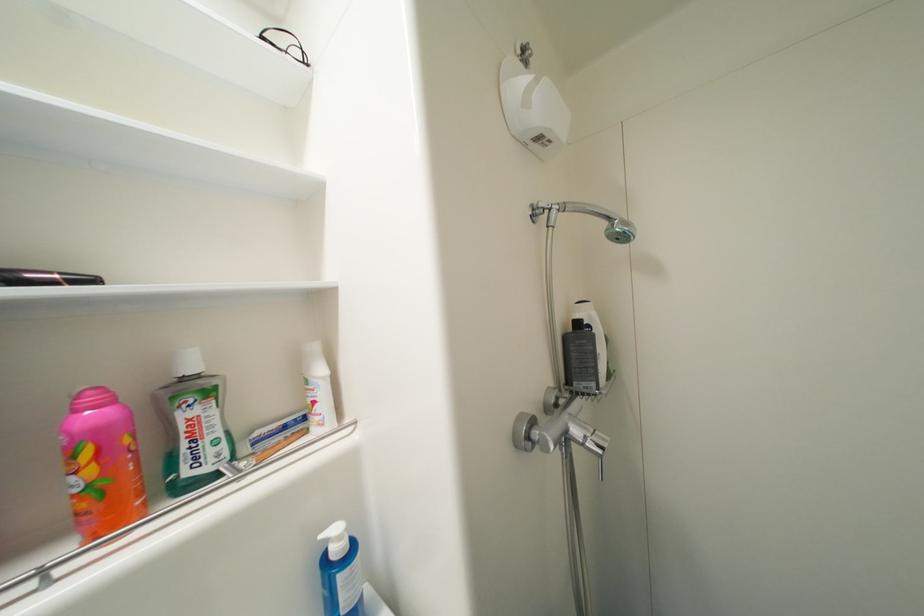
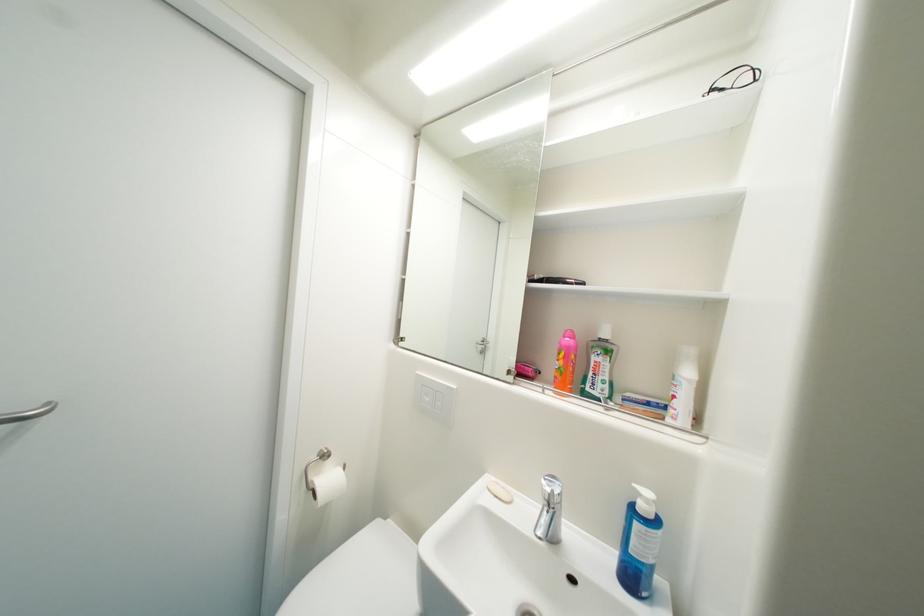
Where in the second image is the point corresponding to [263,436] from the first image?

(635, 397)